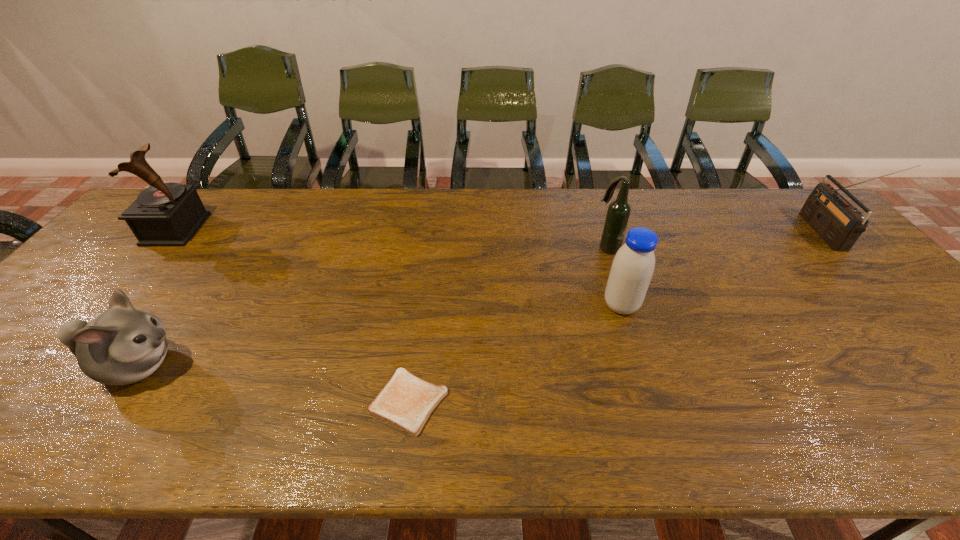
At what (x,y) coordinates should I click in order to perform the action: click on object situated at the far left corner. Please return your answer as a coordinate pair (x, y). The image size is (960, 540). Looking at the image, I should click on (165, 214).

Locate an element on the screen. The width and height of the screenshot is (960, 540). object that is at the far right corner is located at coordinates (839, 224).

This screenshot has height=540, width=960. I want to click on blank space at the far edge of the desktop, so click(x=410, y=199).

You are a GUI agent. You are given a task and a screenshot of the screen. Output one action in this format:
    pyautogui.click(x=<x>, y=<y>)
    Task: Click on the free space at the near edge
    The height and width of the screenshot is (540, 960).
    Given the screenshot: What is the action you would take?
    pyautogui.click(x=588, y=419)

In the image, there is a desktop. Identify the location of vacant space at the left edge. (33, 355).

The height and width of the screenshot is (540, 960). I want to click on unoccupied area between the radio receiver and the hamster, so click(480, 300).

Locate an element on the screen. free spot between the toast and the beer bottle is located at coordinates (508, 325).

Identify the location of free spot between the fourth farthest object and the toast. (515, 354).

This screenshot has height=540, width=960. I want to click on free spot between the phonograph_record and the radio receiver, so click(x=500, y=231).

The image size is (960, 540). I want to click on vacant space that's between the rightmost object and the second shortest object, so click(x=480, y=300).